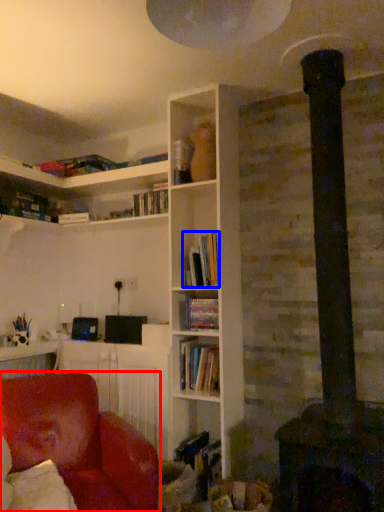
Question: Which object is closer to the camera taking this photo, chair (highlighted by a red box) or book (highlighted by a blue box)?

Choices:
 (A) chair
 (B) book

Answer: (A)